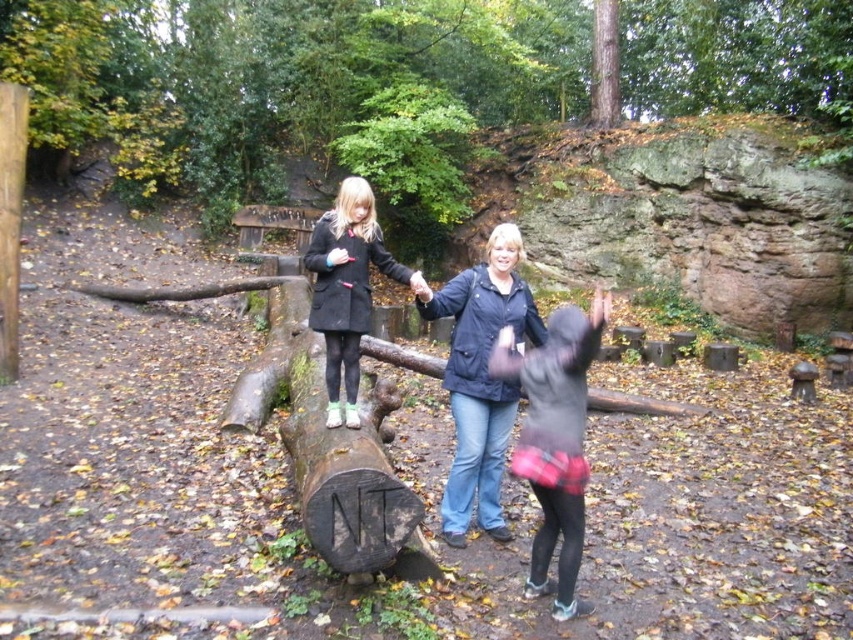
You are a photographer standing at the center of the scene. You want to take a photo that includes both the dark blue jacket at center and the black fuzzy jacket at center. What is the minimum distance you need to move backward so that both jackets are fully visible in your camera frame?

The dark blue jacket at center is 22.84 inches away from the black fuzzy jacket at center. To capture both jackets in the frame, you need to move backward until the distance between them in the camera view is within the frame. However, without knowing the camera sensor size or focal length, an exact distance cannot be calculated. But generally, increasing the distance from the subjects will reduce their apparent separation in the frame, so moving back until the 22.84 inches fits within your desired framing.

You are trying to decide which jacket to take for a hike. You have a dark blue jacket at center and a black fuzzy jacket at center. Which one has a larger width?

The dark blue jacket at center is wider than the black fuzzy jacket at center according to the description.